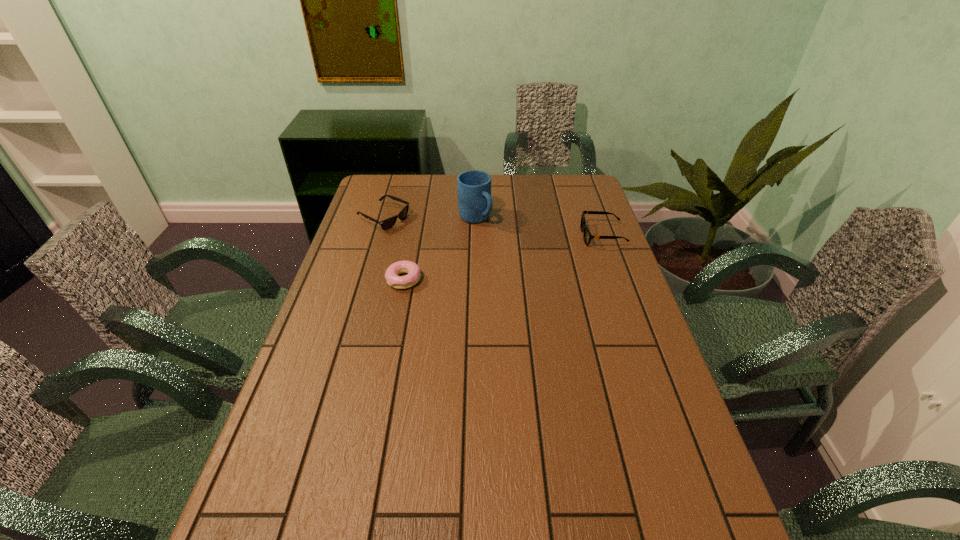
The width and height of the screenshot is (960, 540). Identify the location of free point between the nearest object and the third object from left to right. (440, 249).

The height and width of the screenshot is (540, 960). In order to click on empty space that is in between the nearest object and the right sunglasses in this screenshot , I will do `click(503, 258)`.

Locate an element on the screen. This screenshot has height=540, width=960. free space between the nearest object and the left sunglasses is located at coordinates (394, 249).

Find the location of a particular element. The height and width of the screenshot is (540, 960). the second closest object to the doughnut is located at coordinates (475, 203).

Identify which object is located as the third nearest to the left sunglasses. Please provide its 2D coordinates. Your answer should be formatted as a tuple, i.e. [(x, y)], where the tuple contains the x and y coordinates of a point satisfying the conditions above.

[(587, 236)]

The width and height of the screenshot is (960, 540). Find the location of `free region that satisfies the following two spatial constraints: 1. on the front side of the rightmost object; 2. on the front-facing side of the left sunglasses`. free region that satisfies the following two spatial constraints: 1. on the front side of the rightmost object; 2. on the front-facing side of the left sunglasses is located at coordinates (378, 236).

Find the location of a particular element. Image resolution: width=960 pixels, height=540 pixels. free space that satisfies the following two spatial constraints: 1. on the front side of the rightmost object; 2. on the front-facing side of the left sunglasses is located at coordinates (378, 236).